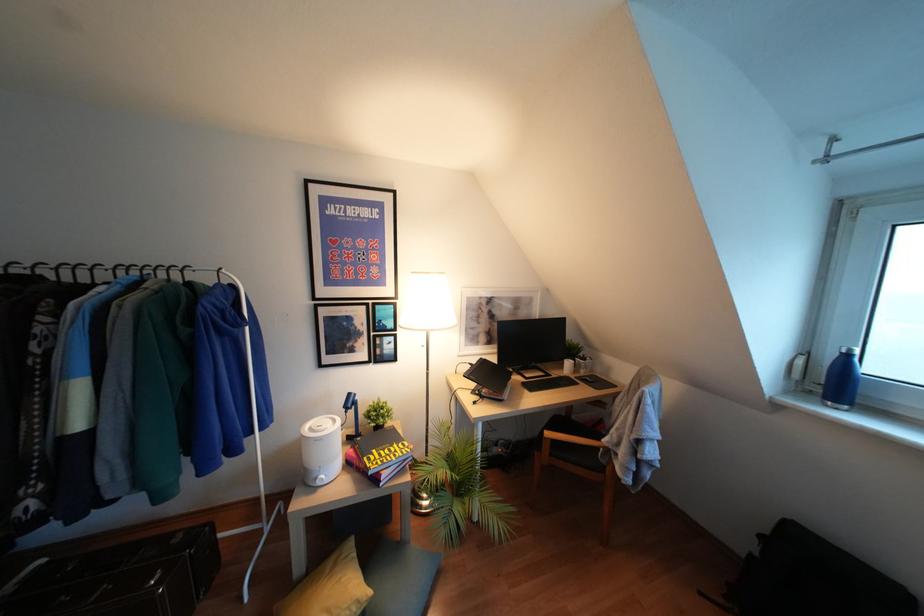
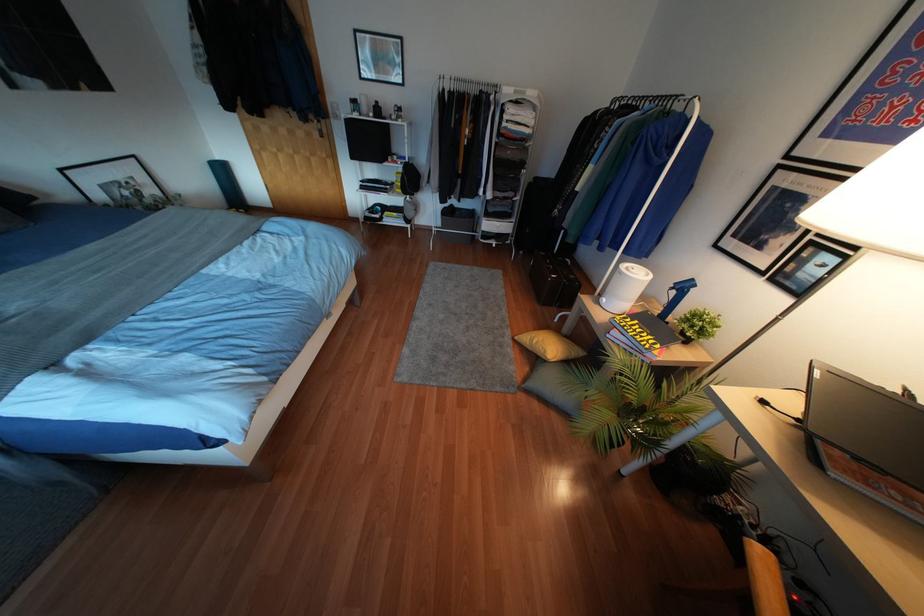
Find the pixel in the second image that matches point 348,394 in the first image.

(690, 280)